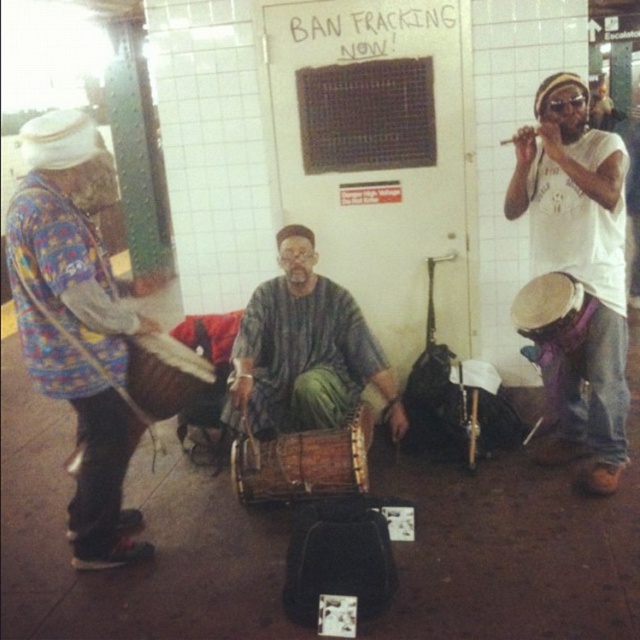
Question: Which object is positioned farthest from the wooden drum at center?

Choices:
 (A) brown textured drum at center
 (B) wooden drum at right
 (C) textured brown drum at center
 (D) multicolored fabric drum at left

Answer: (B)

Question: Where is multicolored fabric drum at left located in relation to purple fabric drum at right in the image?

Choices:
 (A) below
 (B) above

Answer: (A)

Question: Which point is closer to the camera taking this photo?

Choices:
 (A) (580, 150)
 (B) (131, 401)
 (C) (518, 308)

Answer: (B)

Question: Which object appears closest to the camera in this image?

Choices:
 (A) brown textured drum at center
 (B) wooden drum at center
 (C) textured brown drum at center
 (D) wooden drum at right

Answer: (B)

Question: Can you confirm if multicolored fabric drum at left is smaller than wooden drum at right?

Choices:
 (A) no
 (B) yes

Answer: (A)

Question: Is multicolored fabric drum at left smaller than purple fabric drum at right?

Choices:
 (A) no
 (B) yes

Answer: (A)